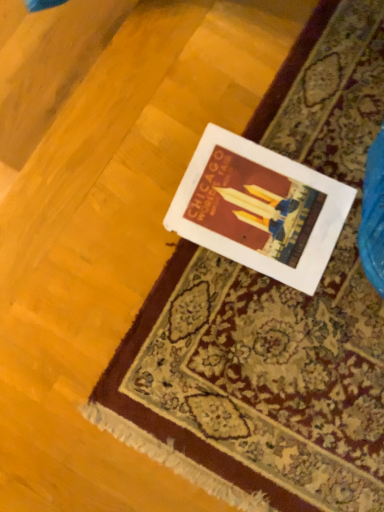
Find the location of a particular element. free space to the left of matte paper book at center is located at coordinates (142, 142).